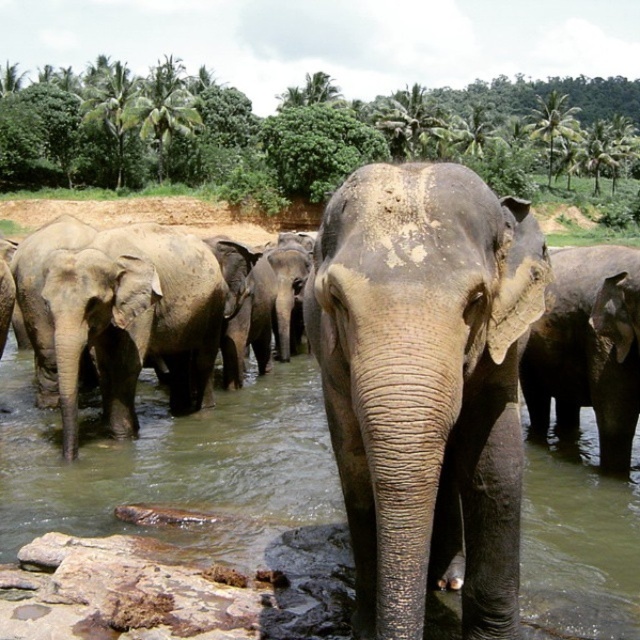
You are standing at the origin point in the scene. Which direction should you move to reach the gray matte elephant at center?

The gray matte elephant at center is located at point (426, 387), so you should move towards the right and forward to reach it.

You are a wildlife photographer trying to capture a closeup of the gray matte elephant at center and the gray matte elephant at left. Since you want to focus on the smaller one, which elephant should you aim your camera at?

The gray matte elephant at center has a smaller size compared to the gray matte elephant at left, so you should aim your camera at the gray matte elephant at center to focus on the smaller one.